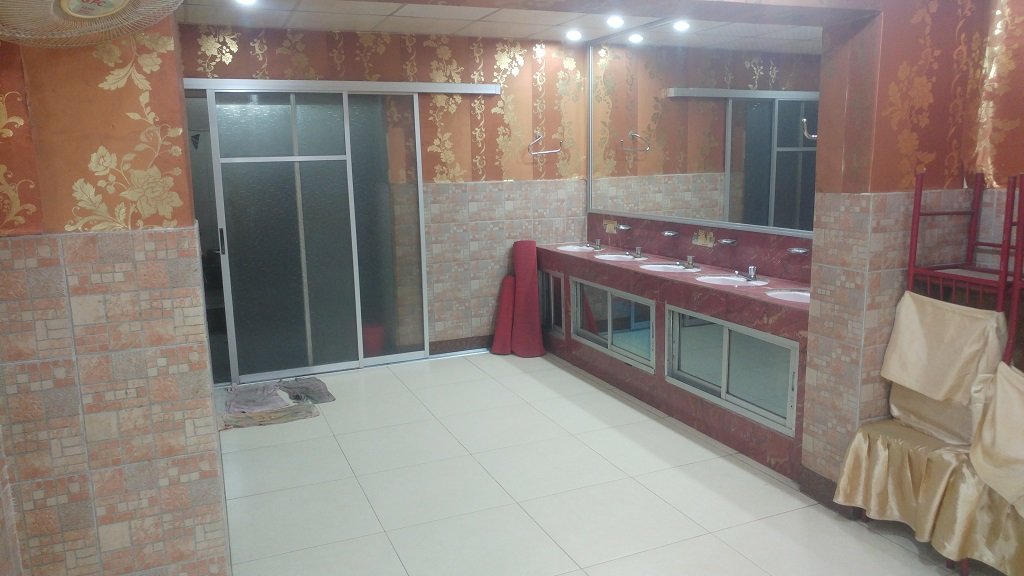
At what (x,y) coordinates should I click in order to perform the action: click on sliding door. Please return your answer as a coordinate pair (x, y). This screenshot has height=576, width=1024. Looking at the image, I should click on (257, 251).